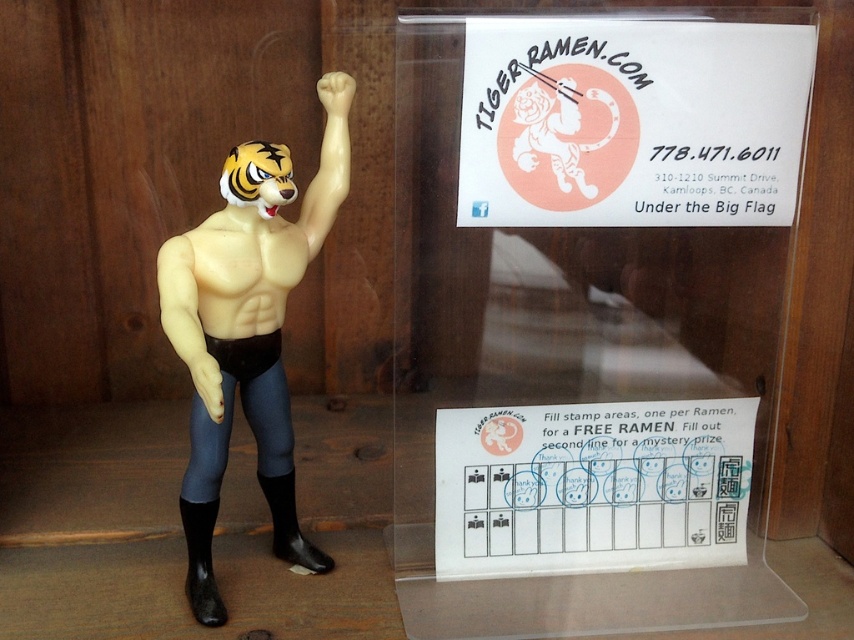
In the scene shown: You are a delivery person who needs to place a 12 inch wide box between the white paper sign at upper center and the smooth beige muscle at center. Is there enough space?

The white paper sign at upper center is 14.20 inches away from the smooth beige muscle at center. Since the box is 12 inches wide, there is enough space to place it between them.

From the picture: You are designing a poster for a local business and need to place both the white paper sign at upper center and the white paper at upper center in the layout. Which one should you make wider to ensure they are visually balanced?

To ensure visual balance, the white paper at upper center should be made wider since the white paper sign at upper center is already wider than the white paper at upper center.